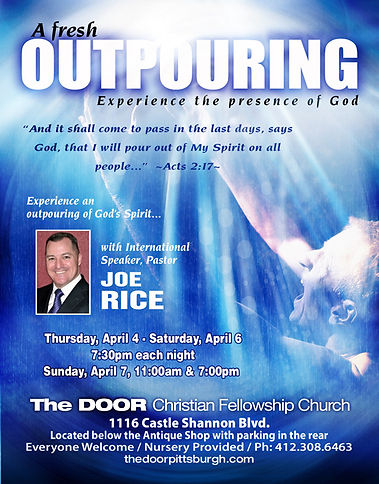
Find the location of a particular element. door is located at coordinates (54, 405).